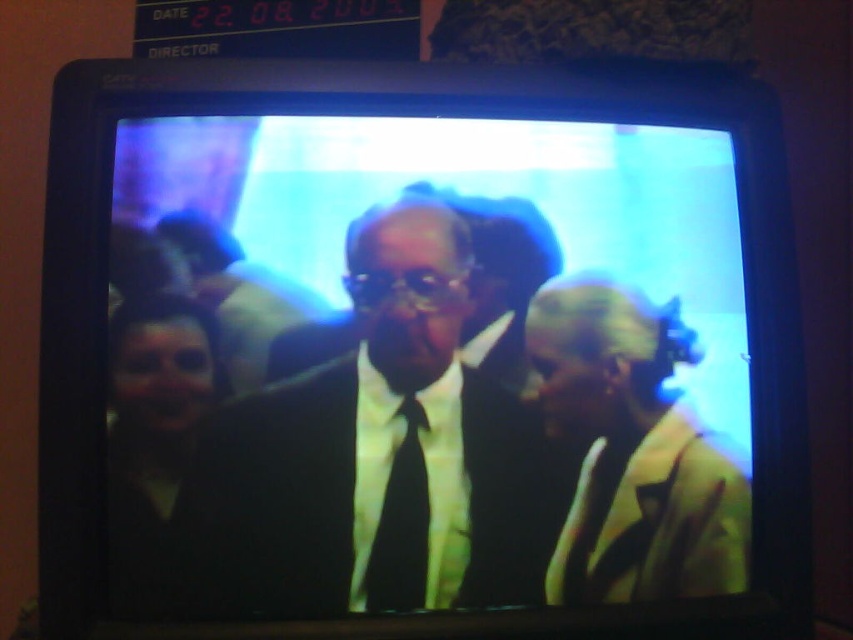
Question: Which point appears farthest from the camera in this image?

Choices:
 (A) (527, 492)
 (B) (569, 588)

Answer: (B)

Question: Does black matte suit at center appear on the right side of matte yellow jacket at right?

Choices:
 (A) no
 (B) yes

Answer: (A)

Question: Which point is closer to the camera?

Choices:
 (A) black matte suit at center
 (B) matte yellow jacket at right

Answer: (A)

Question: Considering the real-world distances, which object is closest to the black silk tie at center?

Choices:
 (A) black matte suit at center
 (B) matte yellow jacket at right

Answer: (A)

Question: Can you confirm if matte yellow jacket at right is thinner than black silk tie at center?

Choices:
 (A) no
 (B) yes

Answer: (A)

Question: Does matte yellow jacket at right lie in front of black silk tie at center?

Choices:
 (A) yes
 (B) no

Answer: (B)